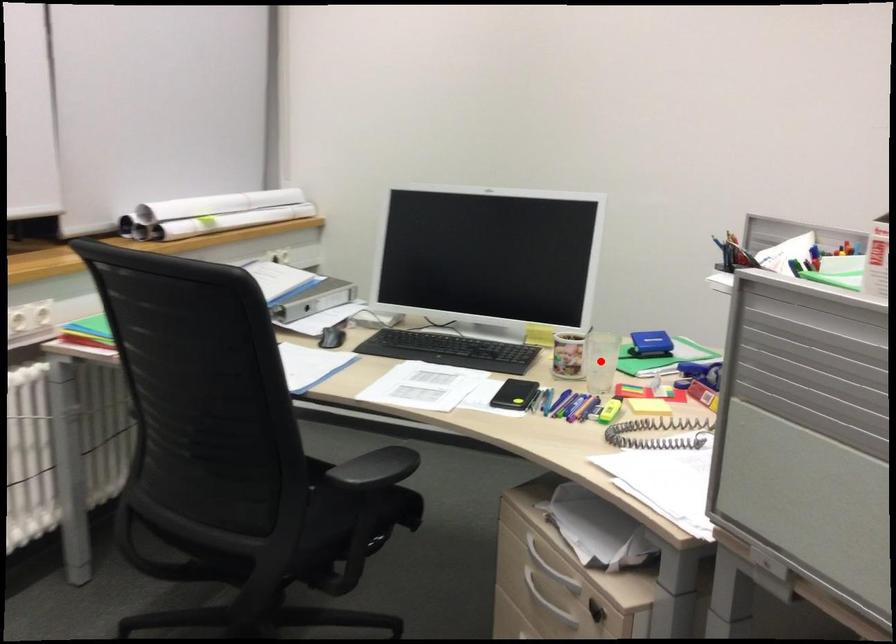
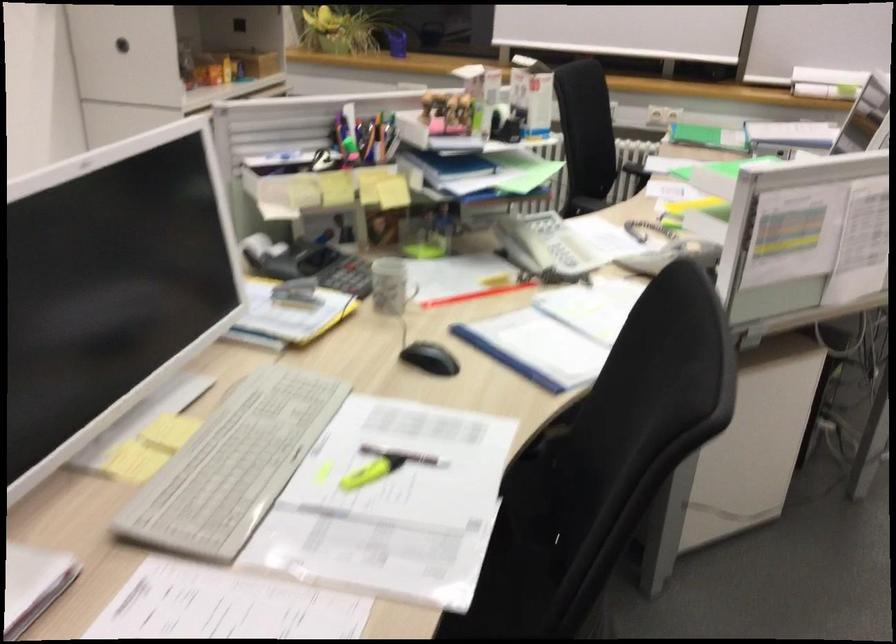
Question: I am providing you with two images of the same scene from different viewpoints. A red point is marked on the first image. Can you still see the location of the red point in image 2?

Choices:
 (A) Yes
 (B) No

Answer: (B)